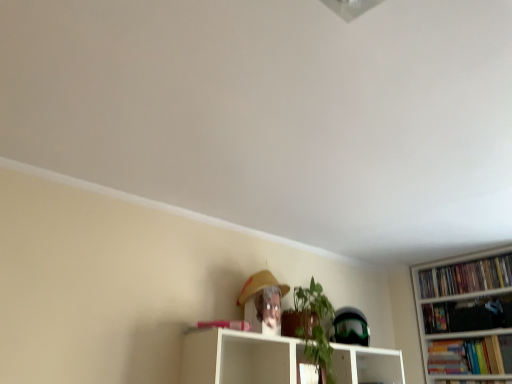
Question: Can you confirm if white glossy shelf at center is taller than matte yellow straw hat at upper center?

Choices:
 (A) no
 (B) yes

Answer: (A)

Question: Are white glossy shelf at center and matte yellow straw hat at upper center making contact?

Choices:
 (A) yes
 (B) no

Answer: (B)

Question: Is white glossy shelf at center shorter than matte yellow straw hat at upper center?

Choices:
 (A) yes
 (B) no

Answer: (A)

Question: Is white glossy shelf at center at the left side of matte yellow straw hat at upper center?

Choices:
 (A) yes
 (B) no

Answer: (B)

Question: Is white glossy shelf at center positioned far away from matte yellow straw hat at upper center?

Choices:
 (A) yes
 (B) no

Answer: (B)

Question: Is white glossy shelf at center inside the boundaries of matte yellow straw hat at upper center, or outside?

Choices:
 (A) inside
 (B) outside

Answer: (B)

Question: Is point (226, 370) positioned closer to the camera than point (247, 317)?

Choices:
 (A) farther
 (B) closer

Answer: (B)

Question: In terms of width, does white glossy shelf at center look wider or thinner when compared to matte yellow straw hat at upper center?

Choices:
 (A) thin
 (B) wide

Answer: (B)

Question: From a real-world perspective, is white glossy shelf at center physically located above or below matte yellow straw hat at upper center?

Choices:
 (A) below
 (B) above

Answer: (A)

Question: From the image's perspective, relative to matte yellow straw hat at upper center, is hardcover book at right, the first book when ordered from bottom to top, above or below?

Choices:
 (A) below
 (B) above

Answer: (A)

Question: In the image, is hardcover book at right, the first book when ordered from bottom to top, positioned in front of or behind matte yellow straw hat at upper center?

Choices:
 (A) front
 (B) behind

Answer: (B)

Question: From a real-world perspective, relative to matte yellow straw hat at upper center, is hardcover book at right, the first book when ordered from bottom to top, vertically above or below?

Choices:
 (A) above
 (B) below

Answer: (B)

Question: Choose the correct answer: Is hardcover book at right, the first book when ordered from bottom to top, inside matte yellow straw hat at upper center or outside it?

Choices:
 (A) outside
 (B) inside

Answer: (A)

Question: Is hardcover book at right, the first book when ordered from bottom to top, wider or thinner than hardcover books at right, arranged as the first book when viewed from the top?

Choices:
 (A) wide
 (B) thin

Answer: (A)

Question: Would you say hardcover book at right, the first book when ordered from bottom to top, is inside or outside hardcover books at right, the 2th book in the bottom-to-top sequence?

Choices:
 (A) inside
 (B) outside

Answer: (B)